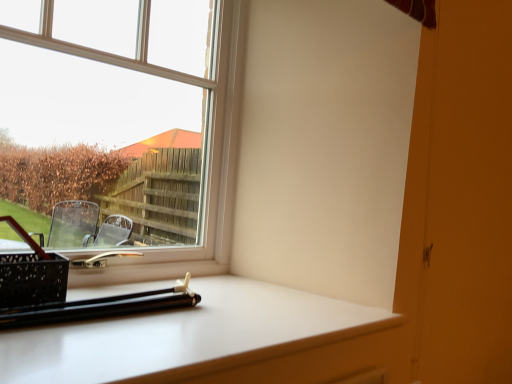
Question: In the image, is clear glass window at upper left on the left side or the right side of white glossy computer desk at lower center?

Choices:
 (A) right
 (B) left

Answer: (B)

Question: Is point (105, 6) positioned closer to the camera than point (374, 354)?

Choices:
 (A) closer
 (B) farther

Answer: (B)

Question: Choose the correct answer: Is clear glass window at upper left inside white glossy computer desk at lower center or outside it?

Choices:
 (A) outside
 (B) inside

Answer: (A)

Question: Is white glossy computer desk at lower center taller or shorter than clear glass window at upper left?

Choices:
 (A) tall
 (B) short

Answer: (B)

Question: Considering the positions of white glossy computer desk at lower center and clear glass window at upper left in the image, is white glossy computer desk at lower center wider or thinner than clear glass window at upper left?

Choices:
 (A) wide
 (B) thin

Answer: (A)

Question: Is white glossy computer desk at lower center spatially inside clear glass window at upper left, or outside of it?

Choices:
 (A) inside
 (B) outside

Answer: (B)

Question: In terms of size, does white glossy computer desk at lower center appear bigger or smaller than clear glass window at upper left?

Choices:
 (A) small
 (B) big

Answer: (A)